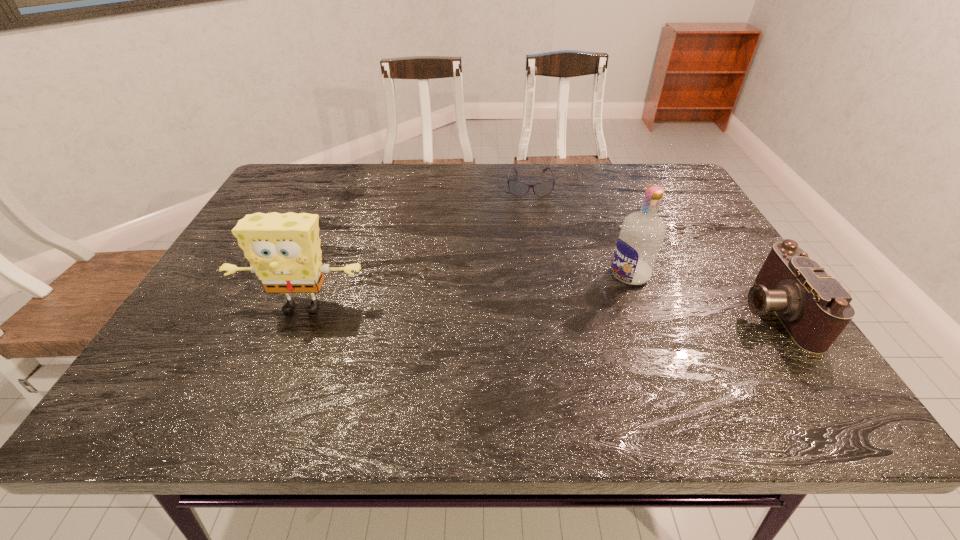
Where is `the leftmost object`? This screenshot has height=540, width=960. the leftmost object is located at coordinates (284, 251).

Locate an element on the screen. Image resolution: width=960 pixels, height=540 pixels. the second shortest object is located at coordinates (814, 308).

Identify the location of camera. (814, 308).

In order to click on the farthest object in this screenshot , I will do `click(518, 188)`.

This screenshot has height=540, width=960. In order to click on the third object from right to left in this screenshot , I will do [x=518, y=188].

This screenshot has width=960, height=540. I want to click on the third object from left to right, so click(642, 233).

You are a GUI agent. You are given a task and a screenshot of the screen. Output one action in this format:
    pyautogui.click(x=<x>, y=<y>)
    Task: Click on the vacant space positioned on the face of the leftmost object
    
    Given the screenshot: What is the action you would take?
    pyautogui.click(x=286, y=347)

Find the location of `free location located 0.100m on the front-facing side of the second shortest object`. free location located 0.100m on the front-facing side of the second shortest object is located at coordinates (696, 311).

You are a GUI agent. You are given a task and a screenshot of the screen. Output one action in this format:
    pyautogui.click(x=<x>, y=<y>)
    Task: Click on the vacant area situated on the front-facing side of the second shortest object
    Image resolution: width=960 pixels, height=540 pixels.
    Given the screenshot: What is the action you would take?
    pyautogui.click(x=714, y=311)

Where is `vacant area situated on the front-facing side of the second shortest object`? vacant area situated on the front-facing side of the second shortest object is located at coordinates (642, 311).